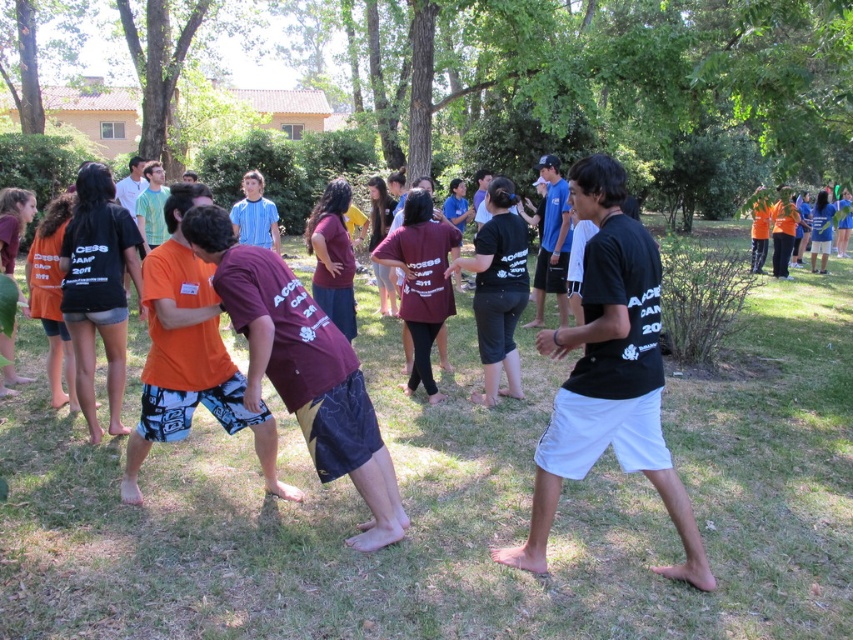
Based on the photo, you are standing in the park and want to walk from point A to point B. Point A is at coordinate point (611, 461) and point B is at coordinate point (584, 204). Which point is closer to you when you start walking?

Point A at coordinate point (611, 461) is closer to you than point B at coordinate point (584, 204) because it is further to the viewer.